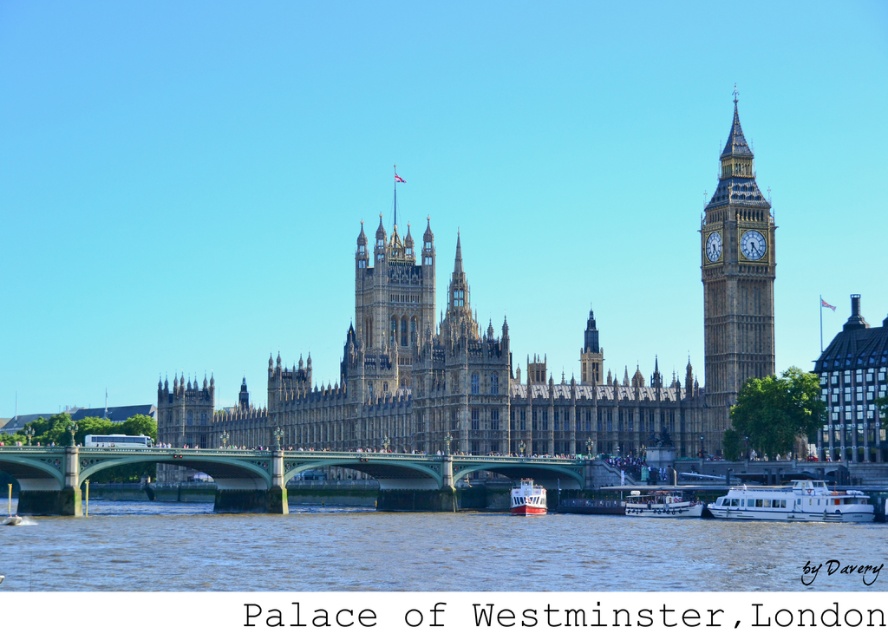
Question: Is white glossy boat at center bigger than white stone clock at upper right?

Choices:
 (A) yes
 (B) no

Answer: (A)

Question: Can you confirm if golden stone clock tower at right is positioned to the right of white glossy boat at center?

Choices:
 (A) yes
 (B) no

Answer: (A)

Question: Which object is the closest to the golden stone clock tower at right?

Choices:
 (A) brown water at lower center
 (B) white glossy boat at lower center
 (C) white glossy boat at center

Answer: (C)

Question: Which of the following is the closest to the observer?

Choices:
 (A) (743, 273)
 (B) (568, 525)
 (C) (758, 257)
 (D) (672, 509)

Answer: (B)

Question: Which point is closer to the camera?

Choices:
 (A) (752, 253)
 (B) (716, 522)
 (C) (862, 493)
 (D) (541, 492)

Answer: (C)

Question: Can you confirm if white glossy boat at lower center is positioned to the right of white glossy boat at center?

Choices:
 (A) yes
 (B) no

Answer: (A)